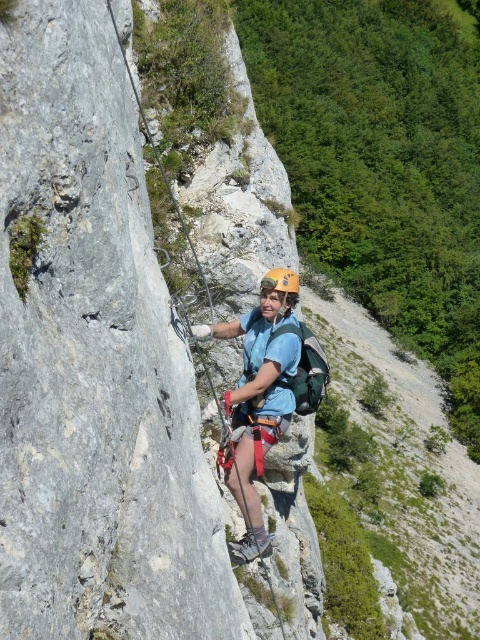
Based on the photo, does matte blue shirt at center appear over yellow matte helmet at center?

No, matte blue shirt at center is not above yellow matte helmet at center.

Who is positioned more to the left, matte blue shirt at center or yellow matte helmet at center?

matte blue shirt at center is more to the left.

Is point (273, 273) behind point (280, 285)?

Yes.

This screenshot has height=640, width=480. In order to click on matte blue shirt at center in this screenshot , I will do `click(257, 397)`.